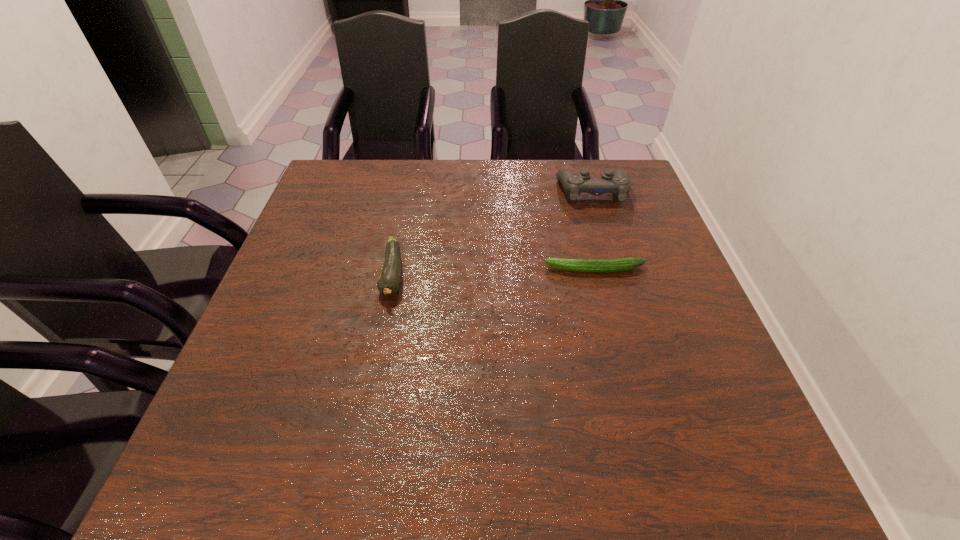
Find the location of a particular element. The height and width of the screenshot is (540, 960). free spot between the tallest object and the shorter zucchini is located at coordinates (593, 230).

At what (x,y) coordinates should I click in order to perform the action: click on free area in between the second shortest object and the shortest object. Please return your answer as a coordinate pair (x, y). Image resolution: width=960 pixels, height=540 pixels. Looking at the image, I should click on (494, 272).

This screenshot has width=960, height=540. I want to click on empty space between the left zucchini and the shortest object, so click(494, 272).

I want to click on unoccupied position between the second tallest object and the farthest object, so click(x=492, y=233).

Identify the location of empty space that is in between the second tallest object and the shortest object. (494, 272).

Locate an element on the screen. free space that is in between the leftmost object and the right zucchini is located at coordinates (494, 272).

Where is `vacant area that lies between the second tallest object and the right zucchini`? vacant area that lies between the second tallest object and the right zucchini is located at coordinates (494, 272).

The width and height of the screenshot is (960, 540). I want to click on vacant space that is in between the left zucchini and the farthest object, so click(492, 233).

Where is `free spot between the farthest object and the shortest object`? This screenshot has height=540, width=960. free spot between the farthest object and the shortest object is located at coordinates (593, 230).

At what (x,y) coordinates should I click in order to perform the action: click on empty location between the farthest object and the second tallest object. Please return your answer as a coordinate pair (x, y). This screenshot has width=960, height=540. Looking at the image, I should click on (492, 233).